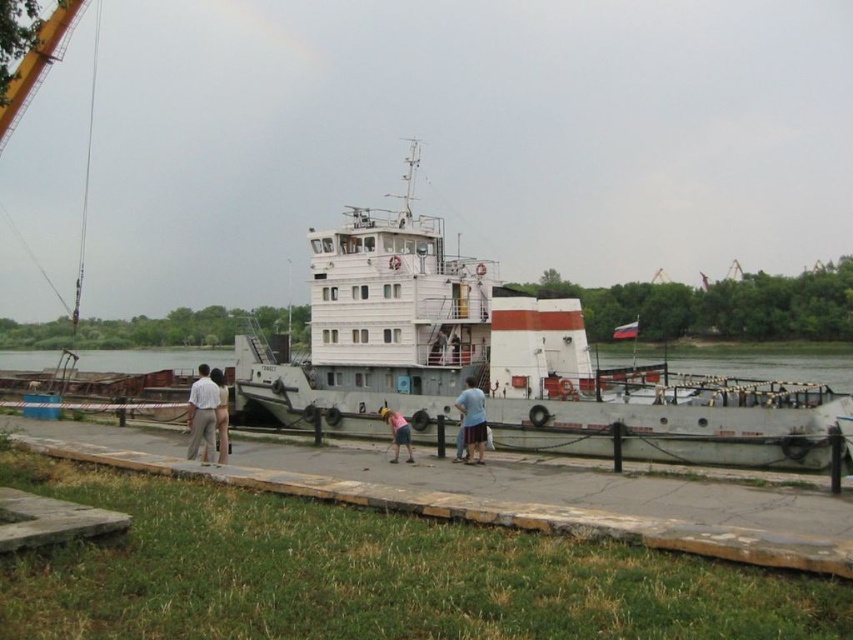
Question: Which of the following is the farthest from the observer?

Choices:
 (A) (467, 426)
 (B) (216, 396)
 (C) (367, 365)

Answer: (C)

Question: Is white matte barge at center to the left of nude skin at center from the viewer's perspective?

Choices:
 (A) no
 (B) yes

Answer: (A)

Question: Among these points, which one is farthest from the camera?

Choices:
 (A) (476, 410)
 (B) (196, 452)
 (C) (567, 381)
 (D) (219, 410)

Answer: (C)

Question: From the image, what is the correct spatial relationship of blue cotton shirt at center in relation to nude skin at center?

Choices:
 (A) above
 (B) below

Answer: (B)

Question: Is blue cotton shirt at center above pink fabric shorts at center?

Choices:
 (A) yes
 (B) no

Answer: (A)

Question: Which object is the closest to the blue cotton shirt at center?

Choices:
 (A) pink fabric shorts at center
 (B) white matte barge at center
 (C) white cotton shirt at left
 (D) nude skin at center

Answer: (A)